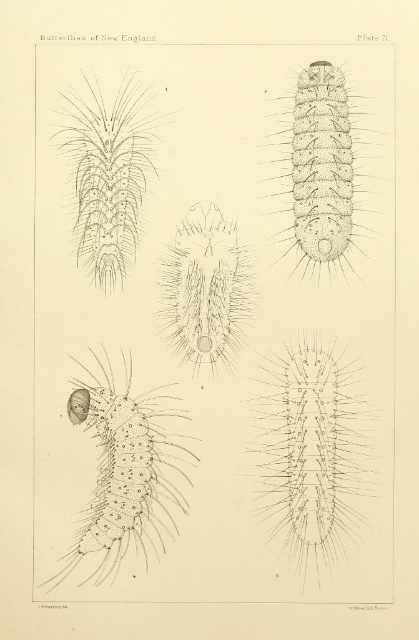
Between gray dotted caterpillar at center and gray spiky caterpillar at upper left, which one appears on the right side from the viewer's perspective?

gray dotted caterpillar at center is more to the right.

Is gray dotted caterpillar at center smaller than gray spiky caterpillar at upper left?

Actually, gray dotted caterpillar at center might be larger than gray spiky caterpillar at upper left.

Identify the location of gray dotted caterpillar at center. (126, 468).

At what (x,y) coordinates should I click in order to perform the action: click on gray dotted caterpillar at center. Please return your answer as a coordinate pair (x, y). The image size is (419, 640). Looking at the image, I should click on (126, 468).

Is spiky brown caterpillar at upper right further to camera compared to gray spiky caterpillar at upper left?

Yes.

Does spiky brown caterpillar at upper right appear over gray spiky caterpillar at upper left?

Indeed, spiky brown caterpillar at upper right is positioned over gray spiky caterpillar at upper left.

Which is behind, point (341, 90) or point (134, 220)?

Point (134, 220)

Find the location of a particular element. This screenshot has height=640, width=419. spiky brown caterpillar at upper right is located at coordinates (320, 168).

The image size is (419, 640). Find the location of `gray dotted caterpillar at center`. gray dotted caterpillar at center is located at coordinates (126, 468).

How far apart are gray dotted caterpillar at center and spiky brown caterpillar at upper right?

The distance of gray dotted caterpillar at center from spiky brown caterpillar at upper right is 50.60 centimeters.

Describe the element at coordinates (126, 468) in the screenshot. I see `gray dotted caterpillar at center` at that location.

Find the location of a particular element. gray dotted caterpillar at center is located at coordinates (126, 468).